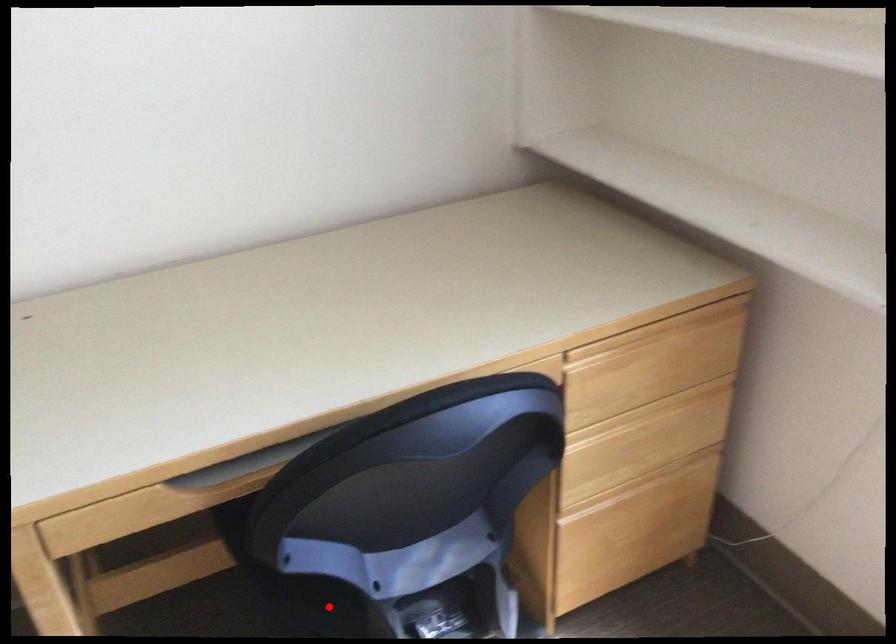
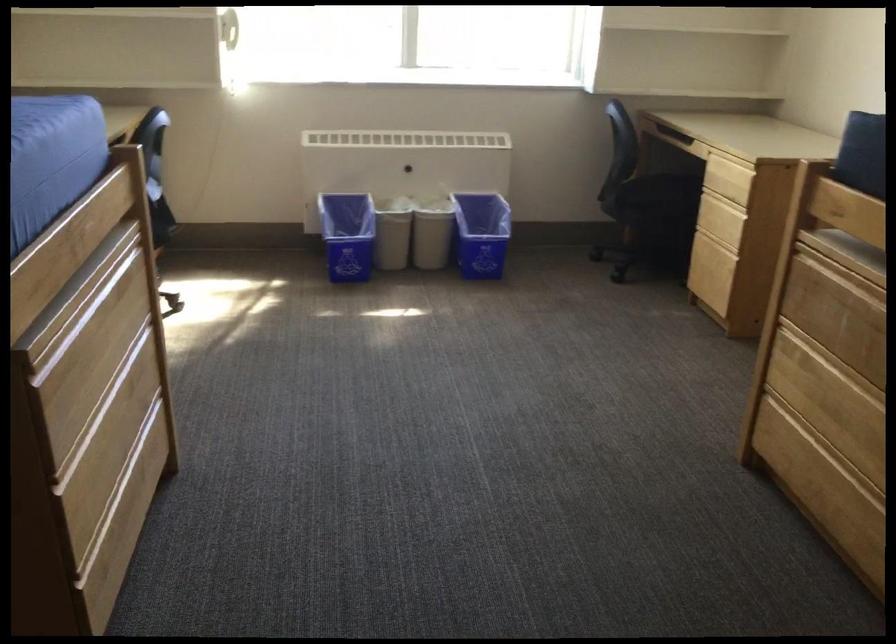
Question: I am providing you with two images of the same scene from different viewpoints. A red point is marked on the first image. Can you still see the location of the red point in image 2?

Choices:
 (A) Yes
 (B) No

Answer: (B)